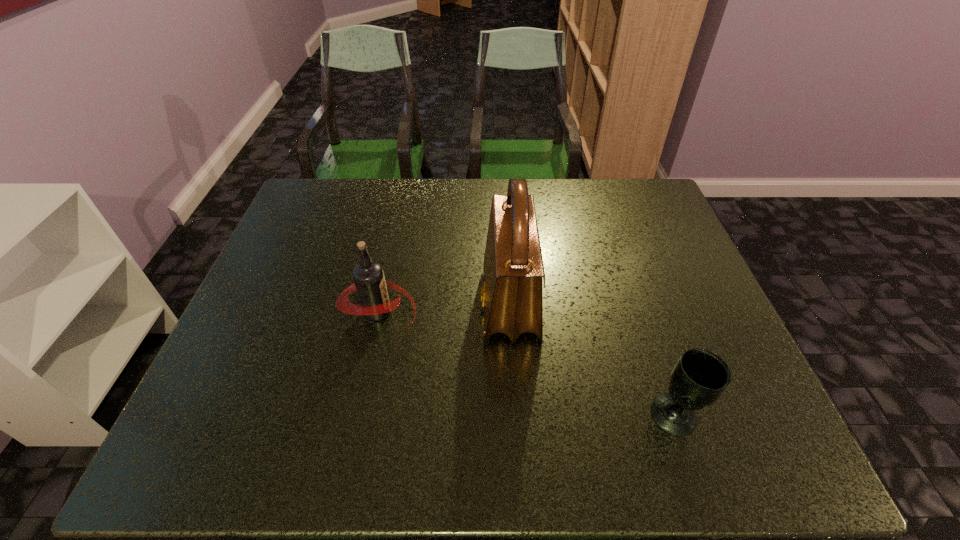
I want to click on free space that satisfies the following two spatial constraints: 1. on the front flap of the shortest object; 2. on the left side of the shoulder bag, so click(x=516, y=414).